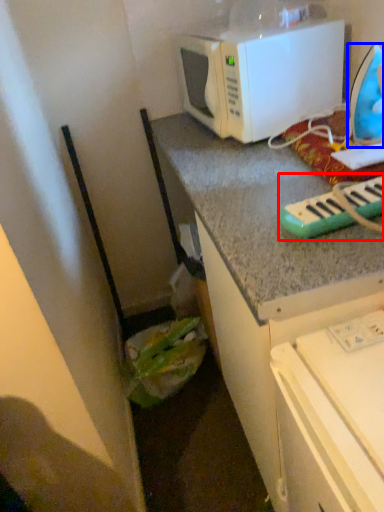
Question: Which of the following is the closest to the observer, musical keyboard (highlighted by a red box) or appliance (highlighted by a blue box)?

Choices:
 (A) musical keyboard
 (B) appliance

Answer: (A)